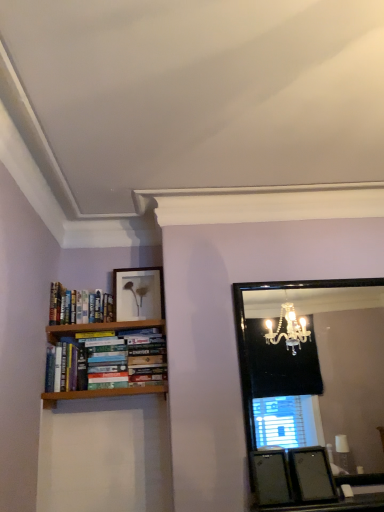
Question: Can you confirm if hardcover books at left is thinner than matte white picture frame at upper center, the 2th picture frame from the bottom?

Choices:
 (A) yes
 (B) no

Answer: (B)

Question: Considering the relative sizes of hardcover books at left and matte white picture frame at upper center, which is the first picture frame in back-to-front order, in the image provided, is hardcover books at left bigger than matte white picture frame at upper center, which is the first picture frame in back-to-front order,?

Choices:
 (A) yes
 (B) no

Answer: (A)

Question: Is hardcover books at left outside matte white picture frame at upper center, arranged as the 1th picture frame when viewed from the top?

Choices:
 (A) yes
 (B) no

Answer: (A)

Question: From a real-world perspective, is hardcover books at left located higher than matte white picture frame at upper center, positioned as the 2th picture frame in front-to-back order?

Choices:
 (A) yes
 (B) no

Answer: (B)

Question: Is hardcover books at left directly adjacent to matte white picture frame at upper center, arranged as the 1th picture frame when viewed from the top?

Choices:
 (A) yes
 (B) no

Answer: (B)

Question: Is matte black picture frame at lower right, the second picture frame in the left-to-right sequence, taller or shorter than hardcover books at left?

Choices:
 (A) short
 (B) tall

Answer: (A)

Question: Is matte black picture frame at lower right, placed as the 1th picture frame when sorted from right to left, bigger or smaller than hardcover books at left?

Choices:
 (A) small
 (B) big

Answer: (A)

Question: Considering their positions, is matte black picture frame at lower right, placed as the 1th picture frame when sorted from right to left, located in front of or behind hardcover books at left?

Choices:
 (A) front
 (B) behind

Answer: (A)

Question: Visually, is matte black picture frame at lower right, the 1th picture frame ordered from the bottom, positioned to the left or to the right of hardcover books at left?

Choices:
 (A) left
 (B) right

Answer: (B)

Question: Is black glass mirror at upper right inside the boundaries of hardcover books at left, or outside?

Choices:
 (A) inside
 (B) outside

Answer: (B)

Question: From the image's perspective, is black glass mirror at upper right located above or below hardcover books at left?

Choices:
 (A) above
 (B) below

Answer: (B)

Question: Considering the positions of point (304, 504) and point (72, 311), is point (304, 504) closer or farther from the camera than point (72, 311)?

Choices:
 (A) closer
 (B) farther

Answer: (A)

Question: In terms of width, does black glass mirror at upper right look wider or thinner when compared to hardcover books at left?

Choices:
 (A) thin
 (B) wide

Answer: (A)

Question: In the image, is black glass mirror at upper right positioned in front of or behind matte white picture frame at upper center, positioned as the 2th picture frame in front-to-back order?

Choices:
 (A) front
 (B) behind

Answer: (A)

Question: Considering the positions of black glass mirror at upper right and matte white picture frame at upper center, which appears as the first picture frame when viewed from the left, in the image, is black glass mirror at upper right wider or thinner than matte white picture frame at upper center, which appears as the first picture frame when viewed from the left,?

Choices:
 (A) thin
 (B) wide

Answer: (B)